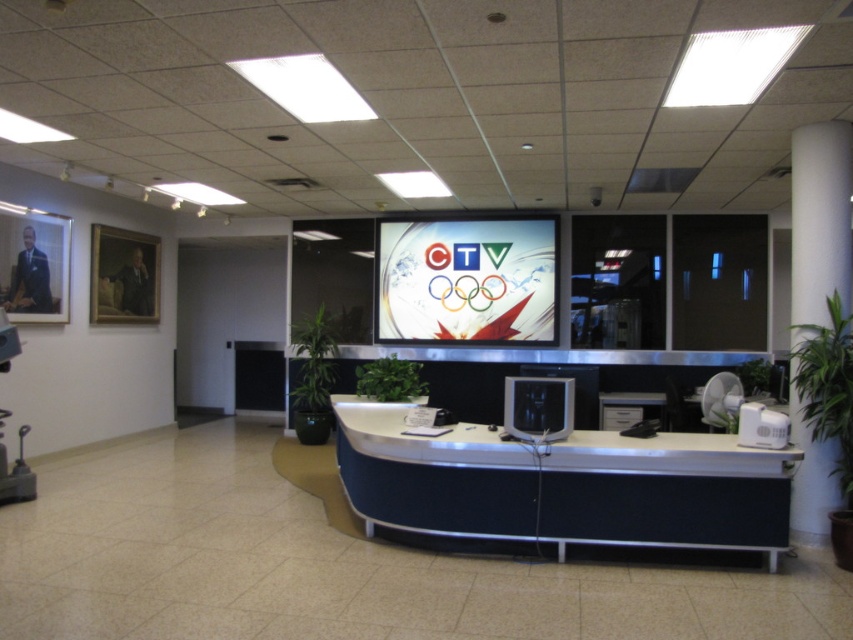
You are an office worker who needs to place a new keyboard on the desk. The keyboard requires 2 square feet of space. Can the blue fabric desk at center accommodate the keyboard along with the existing satin black monitor at center?

The blue fabric desk at center is bigger than the satin black monitor at center. Since the desk is larger, there should be sufficient space to place the keyboard alongside the monitor.

You are an office worker who needs to place a new keyboard that is 30 cm wide on the blue fabric desk at center and the satin black monitor at center. Which surface can accommodate the keyboard without it hanging off the edge?

The blue fabric desk at center has a larger width than the satin black monitor at center, so the keyboard can be placed on the blue fabric desk at center without hanging off the edge.

You are a visitor entering the newsroom and need to locate the reception area. Which object would you see first between the blue fabric desk at center and the white smooth pillar at right?

The blue fabric desk at center is shorter than the white smooth pillar at right, so you would see the white smooth pillar at right first since it is taller and more prominent in the line of sight.